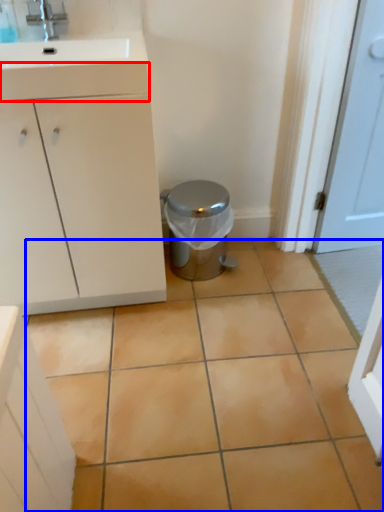
Question: Which point is further to the camera, drawer (highlighted by a red box) or ceramic tile (highlighted by a blue box)?

Choices:
 (A) drawer
 (B) ceramic tile

Answer: (A)